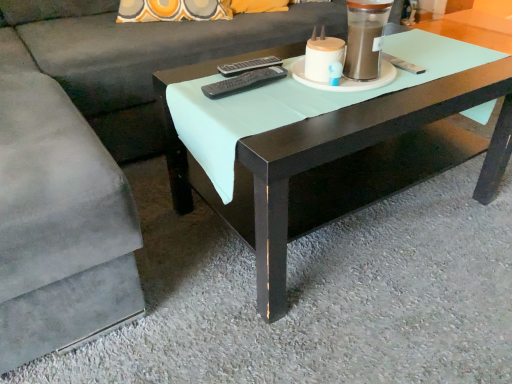
Where is `black plastic remote at center, marked as the first remote in a front-to-back arrangement`? black plastic remote at center, marked as the first remote in a front-to-back arrangement is located at coordinates (244, 81).

This screenshot has width=512, height=384. Identify the location of black plastic remote at center, marked as the first remote in a front-to-back arrangement. (244, 81).

Does matte black coffee table at center have a larger size compared to black plastic remote at center, the 2th remote viewed from the front?

Correct, matte black coffee table at center is larger in size than black plastic remote at center, the 2th remote viewed from the front.

From their relative heights in the image, would you say matte black coffee table at center is taller or shorter than black plastic remote at center, the 2th remote viewed from the front?

Clearly, matte black coffee table at center is taller compared to black plastic remote at center, the 2th remote viewed from the front.

Does matte black coffee table at center turn towards black plastic remote at center, which is the 1th remote in back-to-front order?

No, matte black coffee table at center is not oriented towards black plastic remote at center, which is the 1th remote in back-to-front order.

From a real-world perspective, is matte black coffee table at center above or below black plastic remote at center, the 2th remote viewed from the front?

In terms of real-world spatial position, matte black coffee table at center is below black plastic remote at center, the 2th remote viewed from the front.

Is black plastic remote at center, which is the 1th remote in back-to-front order, at the right side of matte black coffee table at center?

No, black plastic remote at center, which is the 1th remote in back-to-front order, is not to the right of matte black coffee table at center.

Considering the sizes of objects black plastic remote at center, which is the 1th remote in back-to-front order, and matte black coffee table at center in the image provided, who is thinner, black plastic remote at center, which is the 1th remote in back-to-front order, or matte black coffee table at center?

black plastic remote at center, which is the 1th remote in back-to-front order, is thinner.

Would you consider black plastic remote at center, which is the 1th remote in back-to-front order, to be distant from matte black coffee table at center?

Actually, black plastic remote at center, which is the 1th remote in back-to-front order, and matte black coffee table at center are a little close together.

Is point (360, 72) less distant than point (266, 73)?

Yes, it is.

From the picture: Would you say matte white candle holder at upper center is inside or outside black plastic remote at center, the 2th remote viewed from the back?

matte white candle holder at upper center lies outside black plastic remote at center, the 2th remote viewed from the back.

Locate an element on the screen. Image resolution: width=512 pixels, height=384 pixels. candle holder that appears on the right of black plastic remote at center, marked as the first remote in a front-to-back arrangement is located at coordinates (365, 38).

Are matte white candle holder at upper center and black plastic remote at center, the 2th remote viewed from the back, far apart?

No, matte white candle holder at upper center is in close proximity to black plastic remote at center, the 2th remote viewed from the back.

From the image's perspective, count 1st remotes downward from the suede gray couch at center and point to it. Please provide its 2D coordinates.

[(249, 65)]

Is suede gray couch at center not within black plastic remote at center, the 2th remote viewed from the front?

Yes, suede gray couch at center is not within black plastic remote at center, the 2th remote viewed from the front.

In terms of height, does suede gray couch at center look taller or shorter compared to black plastic remote at center, which is the 1th remote in back-to-front order?

Clearly, suede gray couch at center is taller compared to black plastic remote at center, which is the 1th remote in back-to-front order.

Considering the sizes of objects suede gray couch at center and black plastic remote at center, which is the 1th remote in back-to-front order, in the image provided, who is bigger, suede gray couch at center or black plastic remote at center, which is the 1th remote in back-to-front order,?

suede gray couch at center.

Is point (157, 57) farther from viewer compared to point (405, 169)?

Yes, it is behind point (405, 169).

Looking at their sizes, would you say suede gray couch at center is wider or thinner than matte black coffee table at center?

Clearly, suede gray couch at center has more width compared to matte black coffee table at center.

Would you consider suede gray couch at center to be distant from matte black coffee table at center?

suede gray couch at center is near matte black coffee table at center, not far away.

Does suede gray couch at center appear on the right side of matte black coffee table at center?

Incorrect, suede gray couch at center is not on the right side of matte black coffee table at center.

Based on the photo, is suede gray couch at center far from matte white candle holder at upper center?

No, suede gray couch at center is not far from matte white candle holder at upper center.

Can you confirm if suede gray couch at center is bigger than matte white candle holder at upper center?

Yes, suede gray couch at center is bigger than matte white candle holder at upper center.

In terms of width, does suede gray couch at center look wider or thinner when compared to matte white candle holder at upper center?

In the image, suede gray couch at center appears to be wider than matte white candle holder at upper center.

What's the angular difference between suede gray couch at center and matte white candle holder at upper center's facing directions?

There is a 2.36-degree angle between the facing directions of suede gray couch at center and matte white candle holder at upper center.

In the image, is matte black coffee table at center positioned in front of or behind suede gray couch at center?

Clearly, matte black coffee table at center is behind suede gray couch at center.

Is matte black coffee table at center placed right next to suede gray couch at center?

No, matte black coffee table at center is not with suede gray couch at center.

Would you say suede gray couch at center is part of matte black coffee table at center's contents?

No, suede gray couch at center is not a part of matte black coffee table at center.

There is a matte black coffee table at center. What are the coordinates of `the 1st remote above it (from a real-world perspective)` in the screenshot? It's located at (249, 65).

The width and height of the screenshot is (512, 384). Find the location of `the 1st remote to the left of the matte black coffee table at center, counting from the anchor's position`. the 1st remote to the left of the matte black coffee table at center, counting from the anchor's position is located at coordinates (249, 65).

In the scene shown: Estimate the real-world distances between objects in this image. Which object is further from suede gray couch at center, black plastic remote at center, marked as the first remote in a front-to-back arrangement, or matte black coffee table at center?

black plastic remote at center, marked as the first remote in a front-to-back arrangement, is further to suede gray couch at center.

When comparing their distances from black plastic remote at center, the 2th remote viewed from the front, does matte white candle holder at upper center or black plastic remote at center, marked as the first remote in a front-to-back arrangement, seem further?

matte white candle holder at upper center is further to black plastic remote at center, the 2th remote viewed from the front.

Looking at the image, which one is located closer to black plastic remote at center, the 2th remote viewed from the front, matte black coffee table at center or matte white candle holder at upper center?

matte white candle holder at upper center is closer to black plastic remote at center, the 2th remote viewed from the front.

When comparing their distances from matte white candle holder at upper center, does black plastic remote at center, marked as the first remote in a front-to-back arrangement, or matte black coffee table at center seem closer?

Based on the image, black plastic remote at center, marked as the first remote in a front-to-back arrangement, appears to be nearer to matte white candle holder at upper center.

Looking at this image, estimate the real-world distances between objects in this image. Which object is further from matte black coffee table at center, black plastic remote at center, the 2th remote viewed from the front, or black plastic remote at center, the 2th remote viewed from the back?

Based on the image, black plastic remote at center, the 2th remote viewed from the front, appears to be further to matte black coffee table at center.

Based on the photo, looking at the image, which one is located closer to black plastic remote at center, marked as the first remote in a front-to-back arrangement, suede gray couch at center or black plastic remote at center, which is the 1th remote in back-to-front order?

black plastic remote at center, which is the 1th remote in back-to-front order, is positioned closer to the anchor black plastic remote at center, marked as the first remote in a front-to-back arrangement.

Looking at the image, which one is located further to suede gray couch at center, matte white candle holder at upper center or matte black coffee table at center?

Based on the image, matte white candle holder at upper center appears to be further to suede gray couch at center.

Based on their spatial positions, is matte white candle holder at upper center or matte black coffee table at center further from black plastic remote at center, marked as the first remote in a front-to-back arrangement?

matte black coffee table at center lies further to black plastic remote at center, marked as the first remote in a front-to-back arrangement, than the other object.

You are a GUI agent. You are given a task and a screenshot of the screen. Output one action in this format:
    pyautogui.click(x=<x>, y=<y>)
    Task: Click on the remote between suede gray couch at center and black plastic remote at center, the 2th remote viewed from the front, from front to back
    
    Given the screenshot: What is the action you would take?
    click(244, 81)

Locate an element on the screen. coffee table positioned between suede gray couch at center and black plastic remote at center, marked as the first remote in a front-to-back arrangement, from near to far is located at coordinates (337, 143).

Identify the location of candle holder between suede gray couch at center and black plastic remote at center, the 2th remote viewed from the front, along the z-axis. Image resolution: width=512 pixels, height=384 pixels. (365, 38).

This screenshot has height=384, width=512. In order to click on coffee table situated between suede gray couch at center and matte white candle holder at upper center from left to right in this screenshot , I will do `click(337, 143)`.